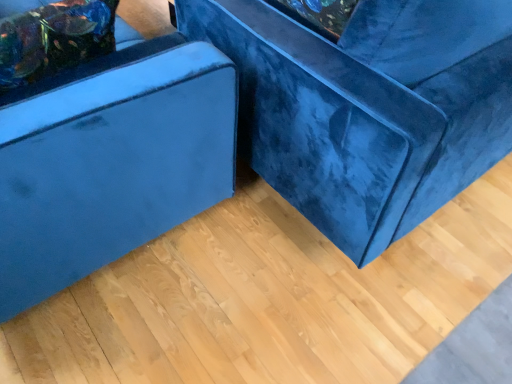
Question: Is velvet blue pillow at upper left positioned far away from velvet blue ottoman at left, the second furniture in the right-to-left sequence?

Choices:
 (A) yes
 (B) no

Answer: (B)

Question: Does velvet blue pillow at upper left have a lesser width compared to velvet blue ottoman at left, the second furniture in the right-to-left sequence?

Choices:
 (A) yes
 (B) no

Answer: (A)

Question: Can you confirm if velvet blue pillow at upper left is shorter than velvet blue ottoman at left, which ranks as the 1th furniture in left-to-right order?

Choices:
 (A) no
 (B) yes

Answer: (B)

Question: Is velvet blue pillow at upper left located outside velvet blue ottoman at left, which ranks as the 1th furniture in left-to-right order?

Choices:
 (A) no
 (B) yes

Answer: (A)

Question: From the image's perspective, would you say velvet blue pillow at upper left is shown under velvet blue ottoman at left, the second furniture in the right-to-left sequence?

Choices:
 (A) no
 (B) yes

Answer: (B)

Question: Based on their sizes in the image, would you say velvet blue ottoman at left, the second furniture in the right-to-left sequence, is bigger or smaller than velvet blue pillow at upper left?

Choices:
 (A) big
 (B) small

Answer: (A)

Question: Which is correct: velvet blue ottoman at left, which ranks as the 1th furniture in left-to-right order, is inside velvet blue pillow at upper left, or outside of it?

Choices:
 (A) inside
 (B) outside

Answer: (B)

Question: Looking at their shapes, would you say velvet blue ottoman at left, which ranks as the 1th furniture in left-to-right order, is wider or thinner than velvet blue pillow at upper left?

Choices:
 (A) wide
 (B) thin

Answer: (A)

Question: Would you say velvet blue ottoman at left, the second furniture in the right-to-left sequence, is to the left or to the right of velvet blue pillow at upper left in the picture?

Choices:
 (A) right
 (B) left

Answer: (B)

Question: Is velvet blue couch at center, the second furniture in the left-to-right sequence, to the left or to the right of velvet blue pillow at upper left in the image?

Choices:
 (A) right
 (B) left

Answer: (A)

Question: Looking at the image, does velvet blue couch at center, which ranks as the 1th furniture in right-to-left order, seem bigger or smaller compared to velvet blue pillow at upper left?

Choices:
 (A) small
 (B) big

Answer: (B)

Question: Is velvet blue couch at center, the second furniture in the left-to-right sequence, wider or thinner than velvet blue pillow at upper left?

Choices:
 (A) thin
 (B) wide

Answer: (B)

Question: From the image's perspective, is velvet blue couch at center, the second furniture in the left-to-right sequence, positioned above or below velvet blue pillow at upper left?

Choices:
 (A) below
 (B) above

Answer: (B)

Question: Considering the relative positions of velvet blue ottoman at left, the second furniture in the right-to-left sequence, and velvet blue couch at center, the second furniture in the left-to-right sequence, in the image provided, is velvet blue ottoman at left, the second furniture in the right-to-left sequence, to the left or to the right of velvet blue couch at center, the second furniture in the left-to-right sequence,?

Choices:
 (A) left
 (B) right

Answer: (A)

Question: From the image's perspective, is velvet blue ottoman at left, which ranks as the 1th furniture in left-to-right order, located above or below velvet blue couch at center, which ranks as the 1th furniture in right-to-left order?

Choices:
 (A) below
 (B) above

Answer: (A)